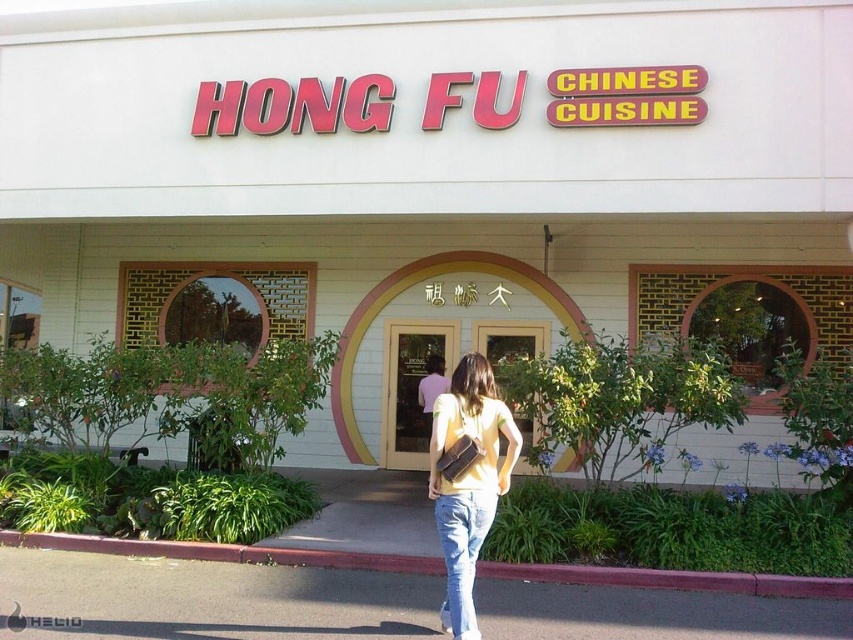
Question: Estimate the real-world distances between objects in this image. Which object is farther from the gray asphalt at lower center?

Choices:
 (A) yellow matte shirt at center
 (B) jeans at center

Answer: (A)

Question: Can you confirm if gray asphalt at lower center is thinner than jeans at center?

Choices:
 (A) yes
 (B) no

Answer: (B)

Question: Does yellow matte shirt at center lie in front of jeans at center?

Choices:
 (A) no
 (B) yes

Answer: (A)

Question: Which point appears farthest from the camera in this image?

Choices:
 (A) (459, 630)
 (B) (469, 582)
 (C) (840, 634)

Answer: (C)

Question: Can you confirm if gray asphalt at lower center is positioned above jeans at center?

Choices:
 (A) no
 (B) yes

Answer: (A)

Question: Among these points, which one is nearest to the camera?

Choices:
 (A) (480, 492)
 (B) (454, 528)

Answer: (B)